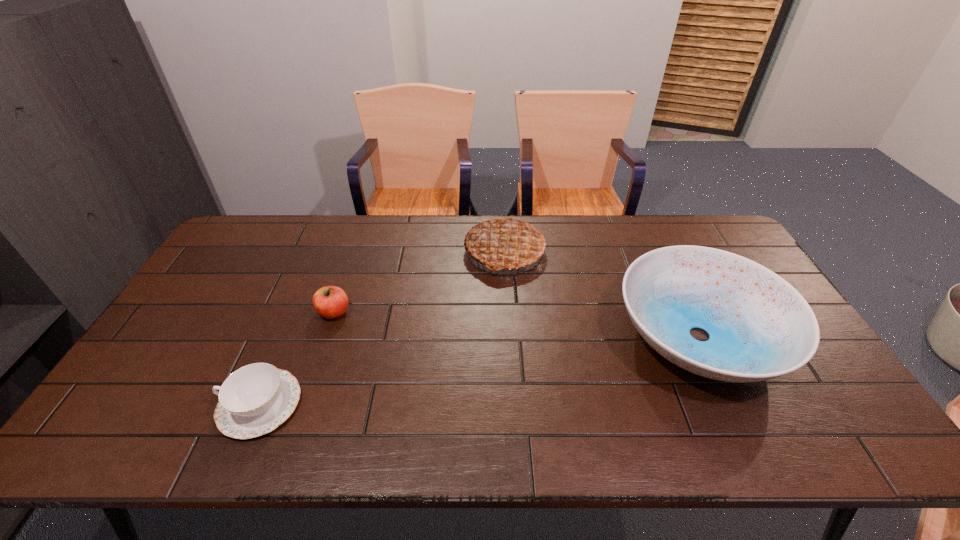
You are a GUI agent. You are given a task and a screenshot of the screen. Output one action in this format:
    pyautogui.click(x=<x>, y=<y>)
    Task: Click on the tallest object
    This screenshot has width=960, height=540.
    Given the screenshot: What is the action you would take?
    pyautogui.click(x=507, y=243)

Identify the location of pie. Image resolution: width=960 pixels, height=540 pixels. (507, 243).

Locate an element on the screen. This screenshot has width=960, height=540. the rightmost object is located at coordinates (760, 327).

Find the location of a particular element. This screenshot has height=540, width=960. dish is located at coordinates (760, 327).

Image resolution: width=960 pixels, height=540 pixels. In order to click on apple in this screenshot , I will do `click(330, 302)`.

You are a GUI agent. You are given a task and a screenshot of the screen. Output one action in this format:
    pyautogui.click(x=<x>, y=<y>)
    Task: Click on the shortest object
    
    Given the screenshot: What is the action you would take?
    pyautogui.click(x=254, y=400)

Where is `free space located 0.340m on the right of the third object from left to right`? free space located 0.340m on the right of the third object from left to right is located at coordinates (645, 252).

This screenshot has width=960, height=540. Identify the location of free spot located on the back of the second tallest object. point(659,251).

This screenshot has height=540, width=960. Identify the location of free point located 0.310m on the front of the second shortest object. (297, 423).

You are a GUI agent. You are given a task and a screenshot of the screen. Output one action in this format:
    pyautogui.click(x=<x>, y=<y>)
    Task: Click on the free space located on the handle side of the chinaware
    The height and width of the screenshot is (540, 960).
    Given the screenshot: What is the action you would take?
    pyautogui.click(x=201, y=404)